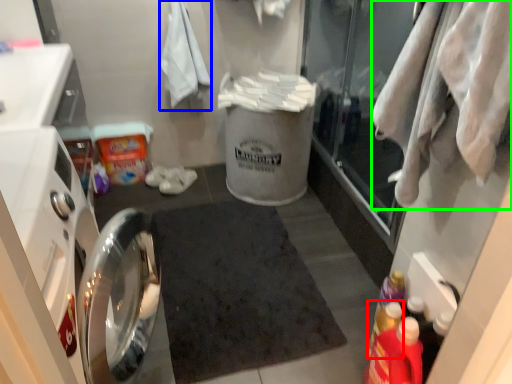
Question: Which object is the farthest from bottle (highlighted by a red box)? Choose among these: bath towel (highlighted by a blue box) or clothing (highlighted by a green box).

Choices:
 (A) bath towel
 (B) clothing

Answer: (A)